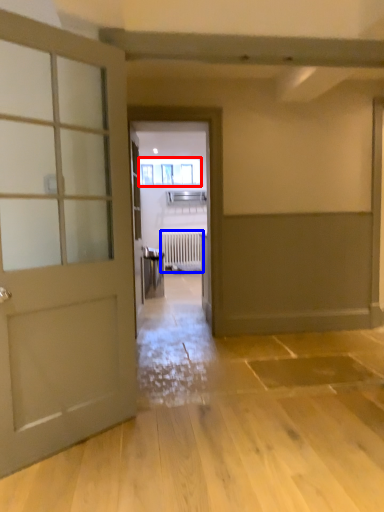
Question: Among these objects, which one is farthest to the camera, window (highlighted by a red box) or radiator (highlighted by a blue box)?

Choices:
 (A) window
 (B) radiator

Answer: (B)